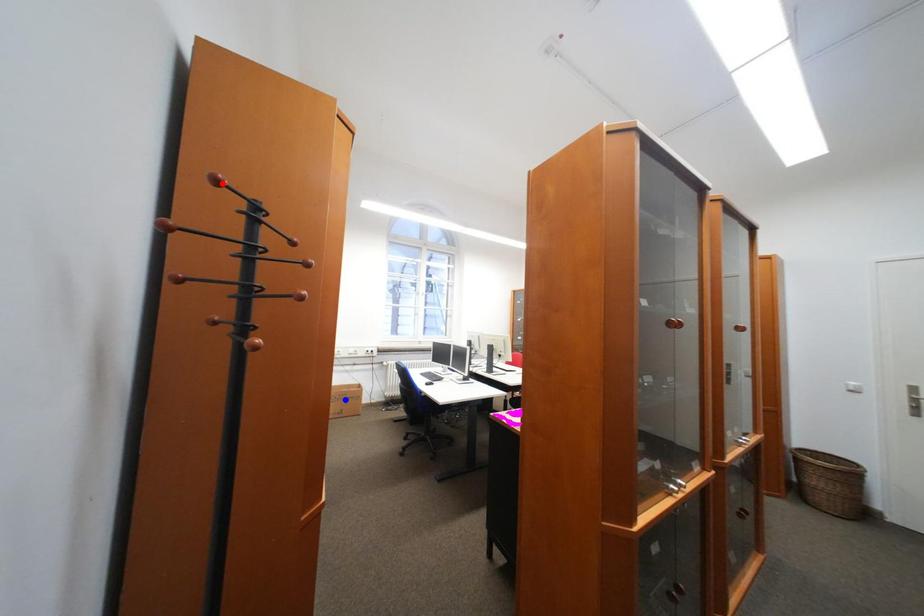
Question: Which of the two points in the image is closer to the camera?

Choices:
 (A) Blue point is closer.
 (B) Red point is closer.

Answer: (B)